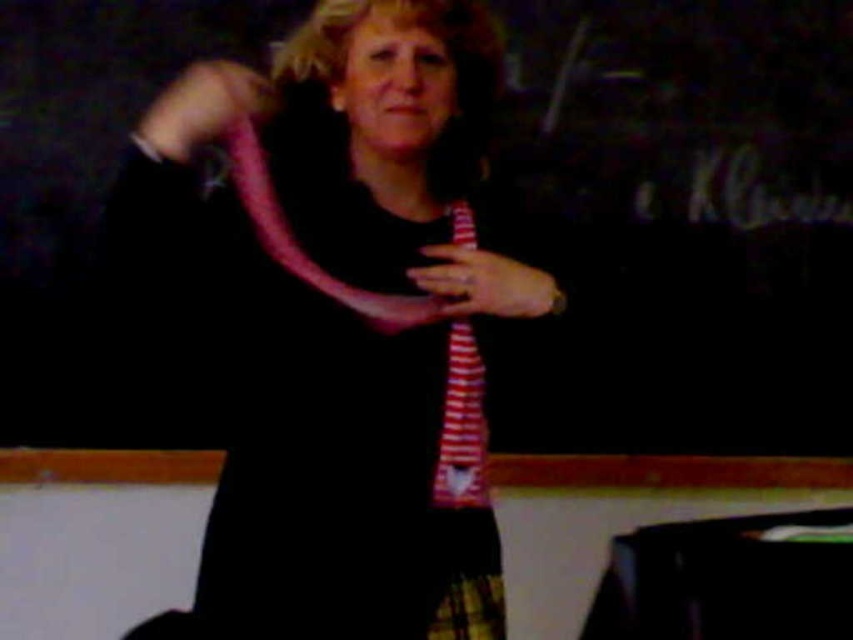
You are a fashion designer who wants to place a new accessory on the black matte dress at center. According to the coordinates provided, where exactly should you place the accessory?

The accessory should be placed at point (339, 467) on the black matte dress at center as specified in the coordinates.

You are a fashion designer observing a model wearing both a striped fabric tie at center and a pink striped scarf at upper center. Which accessory is positioned more to the right?

The striped fabric tie at center is positioned more to the right than the pink striped scarf at upper center.

You are a tailor measuring the distance between the black matte dress at center and the pink striped fabric at center for a fitting. The minimum required space for the tailor tools is 8 inches. Can you confirm if there is enough space between them?

The black matte dress at center and pink striped fabric at center are 8.25 inches apart from each other, which exceeds the minimum required space of 8 inches. Therefore, there is enough space for the tailor tools.